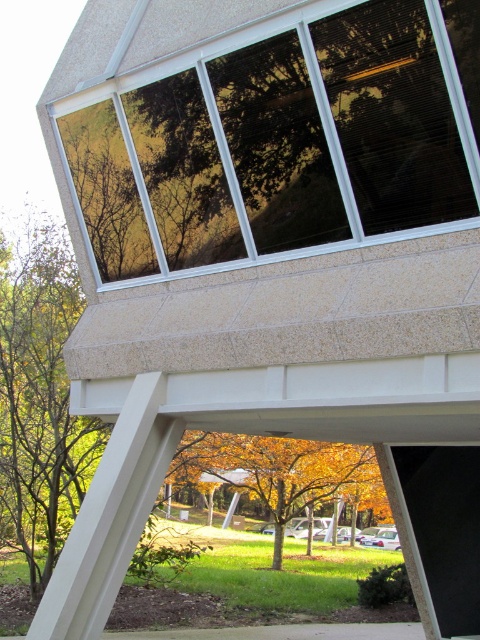
You are standing in front of the building and want to take a photo that includes both the clear glass window at upper center and the golden leafy tree at center. Given that your camera has a maximum focal length that allows capturing objects up to 10 meters apart in the same frame, will you be able to include both in your photo?

The clear glass window at upper center and golden leafy tree at center are 9.52 meters apart, so yes, the camera can capture both in the same frame since the distance is within the 10 meters limit.

You are standing in front of the modern architectural structure and want to determine which of the two points, point (260, 224) or point (278, 554), is closer to you. Based on the scene description, which point is nearer?

Point (260, 224) is closer to the viewer than point (278, 554).